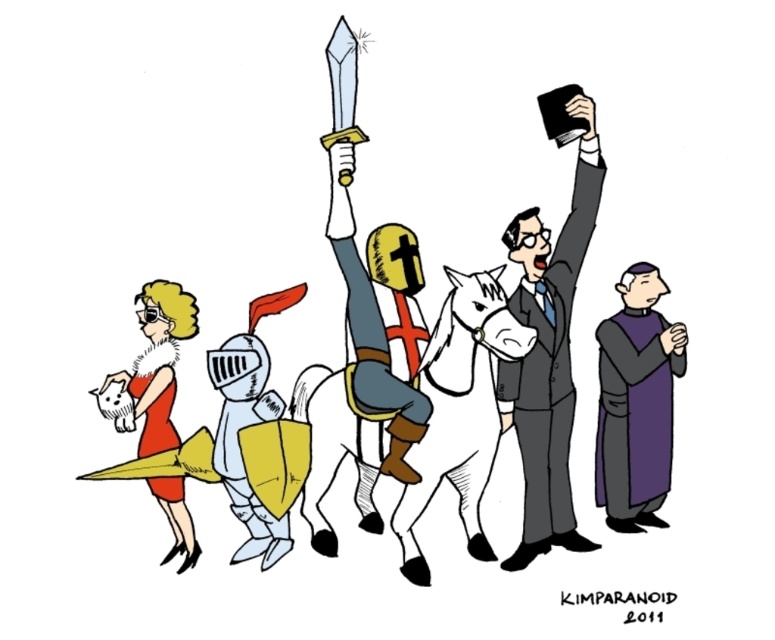
You are standing at the origin point in the image. Which of the two points, point (565, 97) or point (171, 284), is closer to you?

Point (565, 97) is closer to you because it is in front of point (171, 284).

Which object is located at the coordinate point (636, 403)?

The purple velvet robe at right is located at the coordinate point (636, 403).